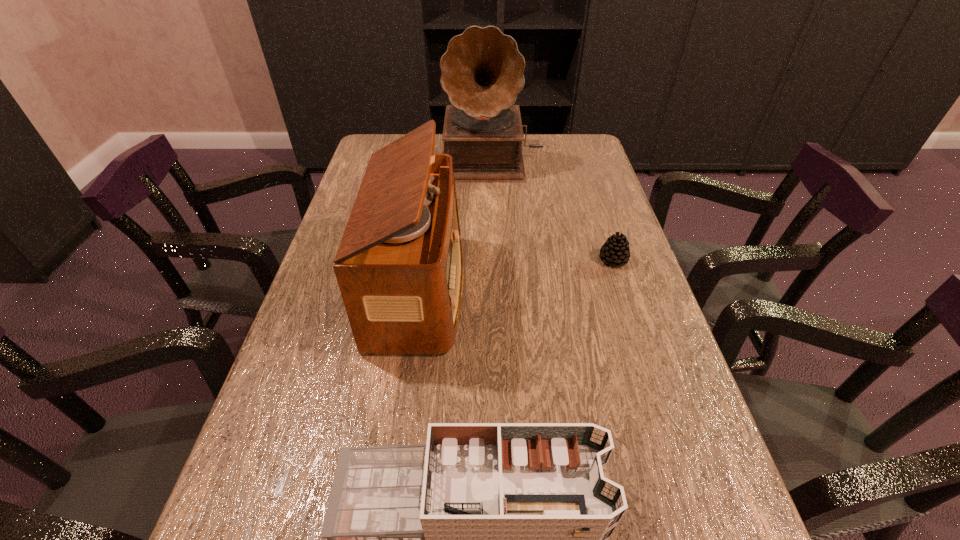
The height and width of the screenshot is (540, 960). Identify the location of object situated at the far edge. (482, 70).

Find the location of `object situated at the left edge`. object situated at the left edge is located at coordinates (399, 266).

Locate an element on the screen. This screenshot has height=540, width=960. object that is at the right edge is located at coordinates (616, 251).

The image size is (960, 540). Find the location of `blank area at the far edge`. blank area at the far edge is located at coordinates (439, 134).

This screenshot has width=960, height=540. In order to click on free space at the left edge of the desktop in this screenshot , I will do `click(254, 512)`.

Where is `vacant region at the right edge of the desktop`? The height and width of the screenshot is (540, 960). vacant region at the right edge of the desktop is located at coordinates (583, 180).

Identify the location of vacant area at the far left corner. The width and height of the screenshot is (960, 540). (380, 140).

Locate an element on the screen. This screenshot has height=540, width=960. vacant space at the far right corner of the desktop is located at coordinates (571, 135).

Where is `empty space that is in between the pinecone and the radio receiver`? This screenshot has height=540, width=960. empty space that is in between the pinecone and the radio receiver is located at coordinates (516, 274).

Where is `object that is the third closest to the radio receiver`? Image resolution: width=960 pixels, height=540 pixels. object that is the third closest to the radio receiver is located at coordinates (616, 251).